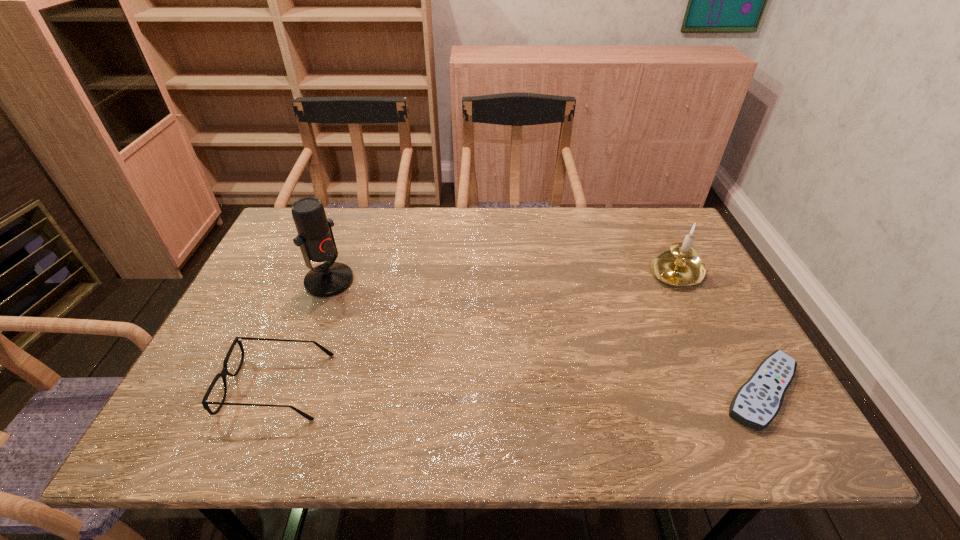
At what (x,y) coordinates should I click in order to perform the action: click on spectacles. Please return your answer as a coordinate pair (x, y). Looking at the image, I should click on (224, 372).

The width and height of the screenshot is (960, 540). Find the location of `the shortest object`. the shortest object is located at coordinates [757, 402].

Identify the location of candle holder. (680, 266).

This screenshot has height=540, width=960. What are the coordinates of `microphone` in the screenshot? It's located at (315, 237).

Locate an element on the screen. This screenshot has height=540, width=960. free region located 0.360m with the lenses facing outward on the spectacles is located at coordinates (491, 386).

Locate an element on the screen. vacant space located on the back of the shortest object is located at coordinates (711, 300).

Where is `vacant region located 0.310m on the handle side of the third shortest object`? vacant region located 0.310m on the handle side of the third shortest object is located at coordinates (x=585, y=340).

Locate an element on the screen. free location located 0.230m on the handle side of the third shortest object is located at coordinates (606, 324).

The height and width of the screenshot is (540, 960). Find the location of `free space located on the handle side of the third shortest object`. free space located on the handle side of the third shortest object is located at coordinates (611, 320).

You are a GUI agent. You are given a task and a screenshot of the screen. Output one action in this format:
    pyautogui.click(x=<x>, y=<y>)
    Task: Click on the vacant space located on the side of the microphone with the red ring
    This screenshot has width=960, height=540.
    Given the screenshot: What is the action you would take?
    pyautogui.click(x=463, y=362)